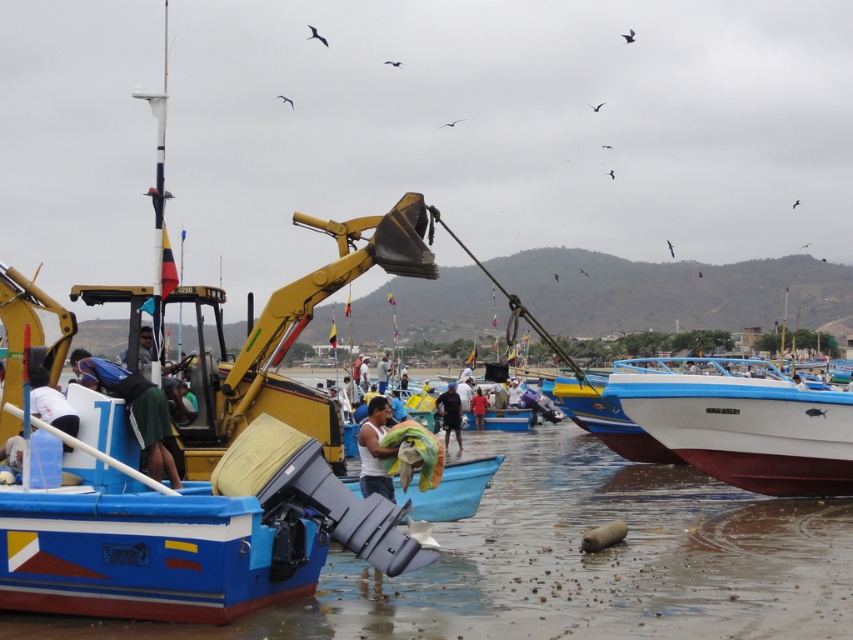
Question: Among these objects, which one is nearest to the camera?

Choices:
 (A) white matte tank top at center
 (B) blue fabric bag at center
 (C) black matte person at center

Answer: (B)

Question: Which of the following is the closest to the observer?

Choices:
 (A) red fabric person at center
 (B) blue fabric bag at center

Answer: (B)

Question: Is white matte tank top at center above black matte person at center?

Choices:
 (A) no
 (B) yes

Answer: (B)

Question: Does blue fabric bag at center appear over black matte person at center?

Choices:
 (A) yes
 (B) no

Answer: (A)

Question: Is white glossy boat at right above black matte person at center?

Choices:
 (A) yes
 (B) no

Answer: (A)

Question: Among these objects, which one is farthest from the camera?

Choices:
 (A) white matte tank top at center
 (B) black matte person at center
 (C) white glossy boat at right

Answer: (B)